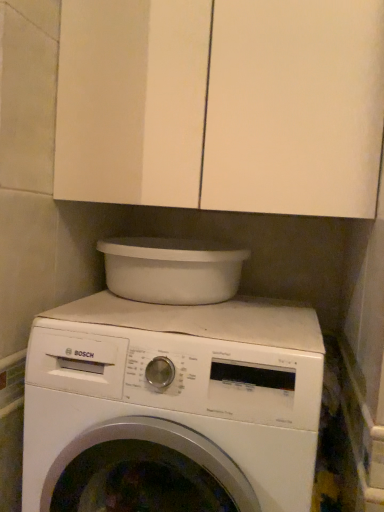
I want to click on empty space that is ontop of white matte washing machine at center (from a real-world perspective), so click(x=183, y=315).